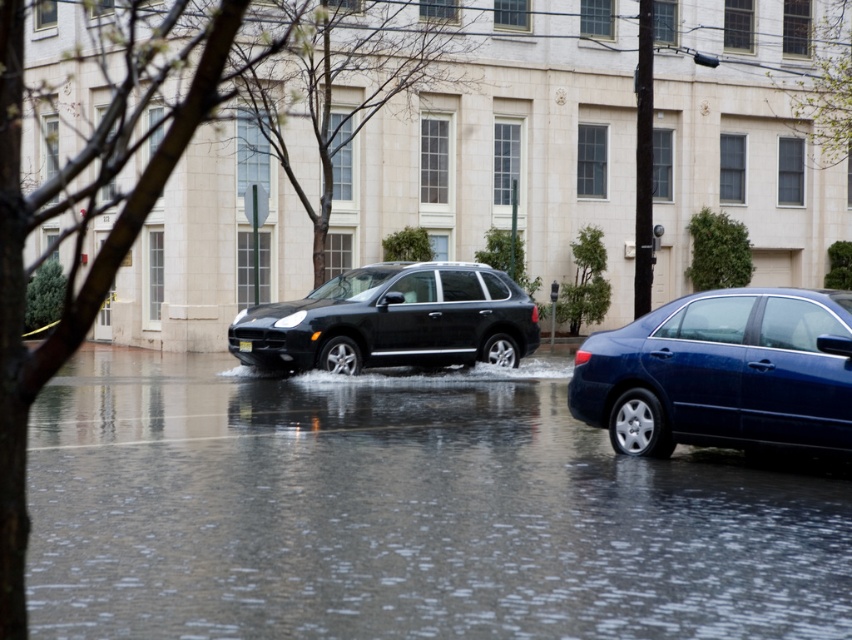
Is glossy blue sedan at right below matte black suv at center?

Indeed, glossy blue sedan at right is positioned under matte black suv at center.

Measure the distance between glossy blue sedan at right and camera.

They are 9.85 meters apart.

At what (x,y) coordinates should I click in order to perform the action: click on glossy blue sedan at right. Please return your answer as a coordinate pair (x, y). This screenshot has width=852, height=640. Looking at the image, I should click on (723, 372).

Does clear water at road center have a greater height compared to matte black suv at center?

Incorrect, clear water at road center's height is not larger of matte black suv at center's.

Is point (681, 600) positioned after point (471, 355)?

No.

I want to click on clear water at road center, so click(401, 513).

Can you confirm if clear water at road center is positioned to the right of glossy blue sedan at right?

Incorrect, clear water at road center is not on the right side of glossy blue sedan at right.

Can you confirm if clear water at road center is positioned below glossy blue sedan at right?

Correct, clear water at road center is located below glossy blue sedan at right.

Who is more distant from viewer, (602, 451) or (619, 448)?

The point (602, 451) is more distant.

Locate an element on the screen. clear water at road center is located at coordinates (401, 513).